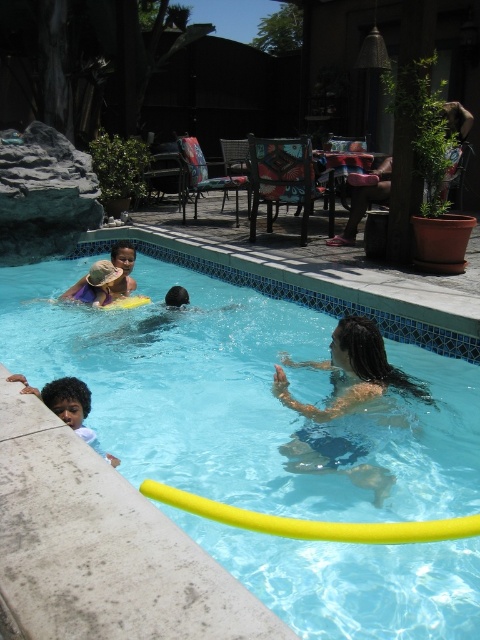
Consider the image. You are a photographer positioned at the edge of the pool. You want to take a photo of the light brown skin at lower left without the brown leather chair at upper right appearing in the frame. Is this possible?

The light brown skin at lower left is behind the brown leather chair at upper right, so the chair would block the view of the light brown skin at lower left. Therefore, it is not possible to take a photo of the light brown skin at lower left without the brown leather chair at upper right appearing in the frame.

You are a lifeguard standing at the edge of the pool. You need to quickly reach either the dark brown hair at center or the brown leather chair at upper right. Which one is closer to you?

The dark brown hair at center is closer to you than the brown leather chair at upper right because they are 11.45 feet apart.

You are a photographer standing on the deck of the pool. You want to take a photo of the dark brown hair at center and the brown leather chair at upper right in the same frame. Which object should you position closer to the camera to ensure both are visible without zooming in?

The dark brown hair at center is shorter than the brown leather chair at upper right. To include both in the frame without zooming, position the dark brown hair at center closer to the camera since it is shorter and might be obscured by the taller brown leather chair if placed farther away.